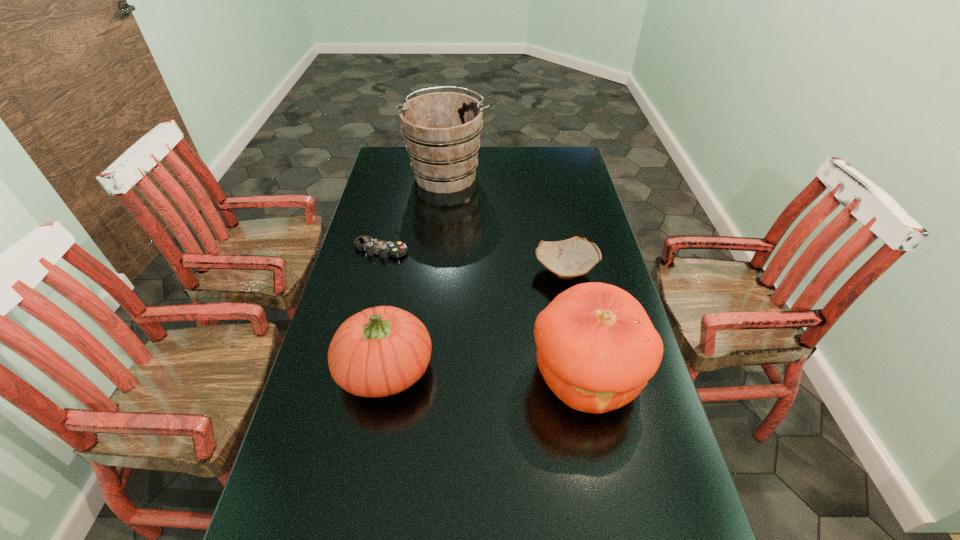
Identify the location of free space between the control and the right pumpkin. The image size is (960, 540). (483, 313).

Image resolution: width=960 pixels, height=540 pixels. I want to click on unoccupied area between the tallest object and the fourth shortest object, so click(516, 275).

Where is `vacant region between the taller pumpkin and the left pumpkin`? The image size is (960, 540). vacant region between the taller pumpkin and the left pumpkin is located at coordinates (485, 373).

Choose which object is the third nearest neighbor to the shortest object. Please provide its 2D coordinates. Your answer should be formatted as a tuple, i.e. [(x, y)], where the tuple contains the x and y coordinates of a point satisfying the conditions above.

[(570, 258)]

Select which object is the second closest to the tallest object. Please provide its 2D coordinates. Your answer should be formatted as a tuple, i.e. [(x, y)], where the tuple contains the x and y coordinates of a point satisfying the conditions above.

[(570, 258)]

What are the coordinates of `vacant region that satisfies the following two spatial constraints: 1. on the front side of the taller pumpkin; 2. on the right side of the shortest object` in the screenshot? It's located at (350, 376).